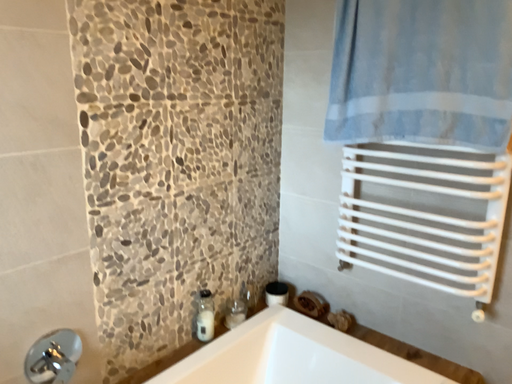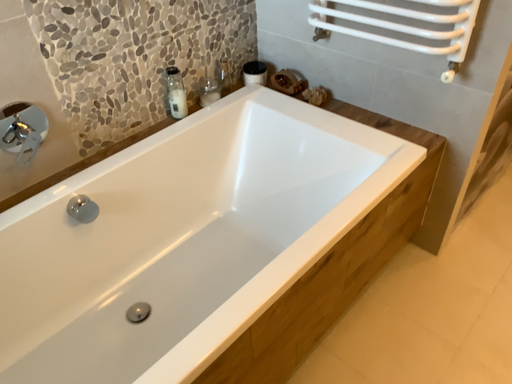
Question: Which way did the camera rotate in the video?

Choices:
 (A) rotated upward
 (B) rotated downward

Answer: (B)